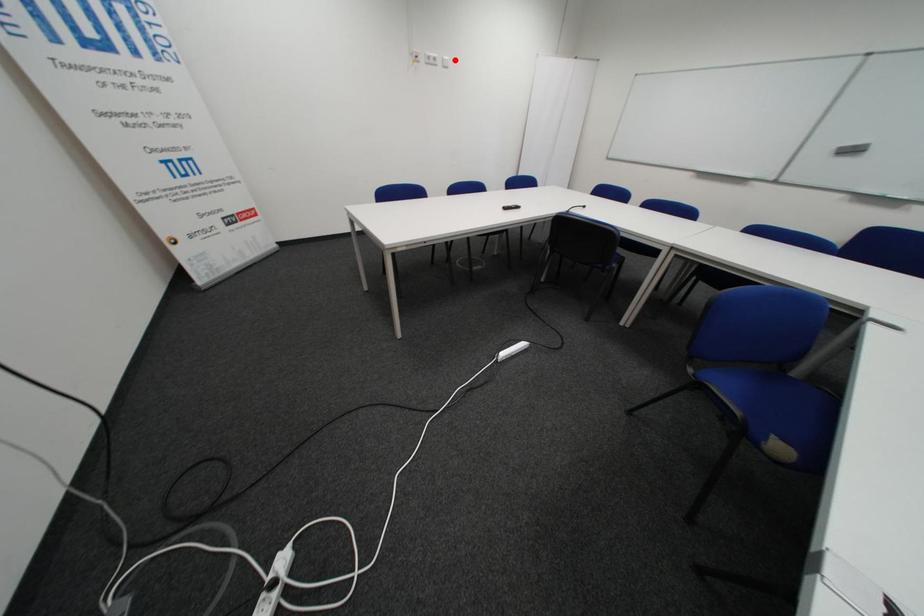
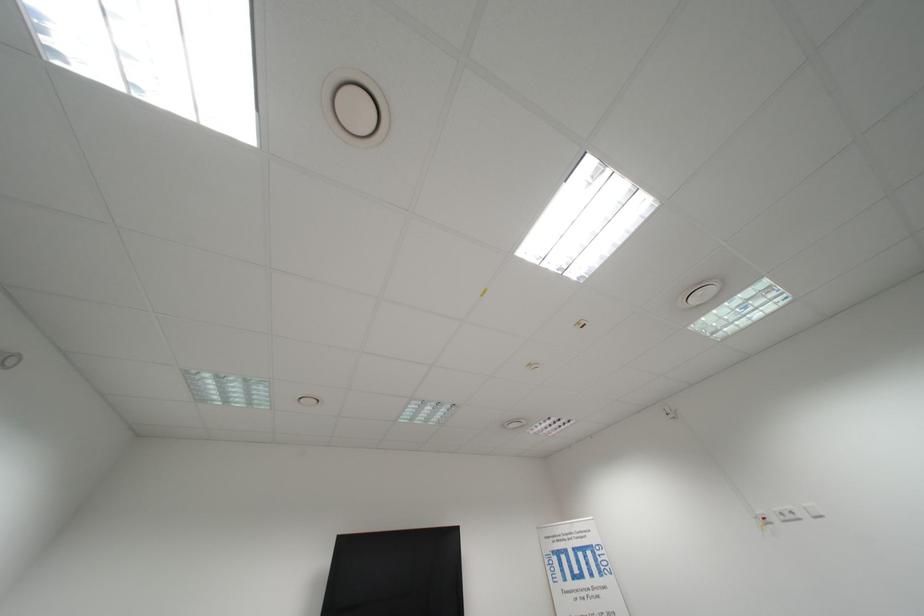
Locate, in the second image, the point that corresponds to the highlighted location in the first image.

(818, 509)